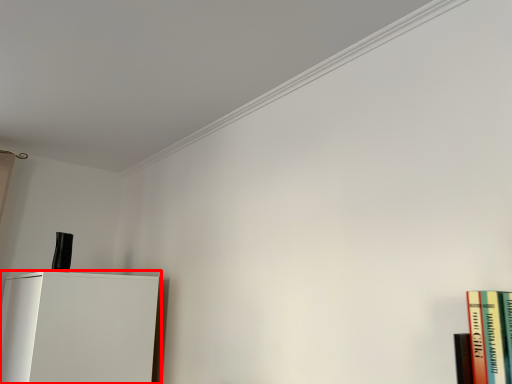
Question: From the image's perspective, what is the correct spatial positioning of furniture (annotated by the red box) in reference to book?

Choices:
 (A) above
 (B) below

Answer: (B)